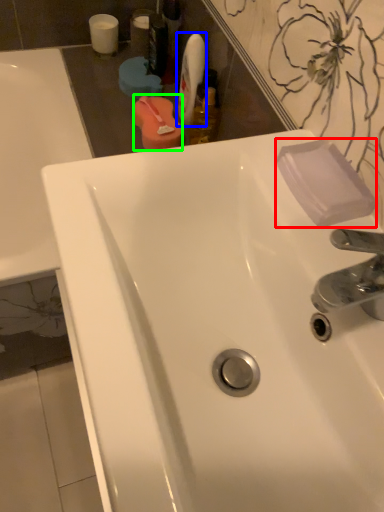
Question: Which is farther away from soap (highlighted by a red box)? mouthwash (highlighted by a blue box) or mouthwash (highlighted by a green box)?

Choices:
 (A) mouthwash
 (B) mouthwash

Answer: (A)